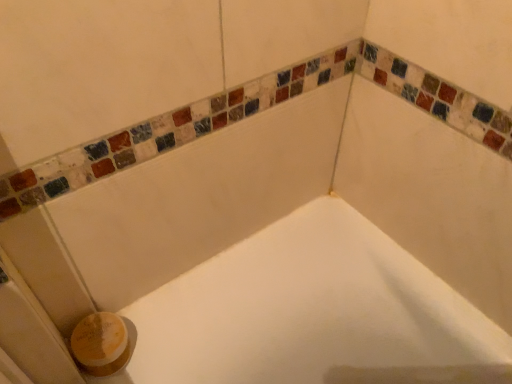
At what (x,y) coordinates should I click in order to perform the action: click on yellow matte soap at lower left. Please return your answer as a coordinate pair (x, y). The height and width of the screenshot is (384, 512). Looking at the image, I should click on (100, 344).

What do you see at coordinates (100, 344) in the screenshot? I see `yellow matte soap at lower left` at bounding box center [100, 344].

Find the location of a particular element. The image size is (512, 384). yellow matte soap at lower left is located at coordinates (100, 344).